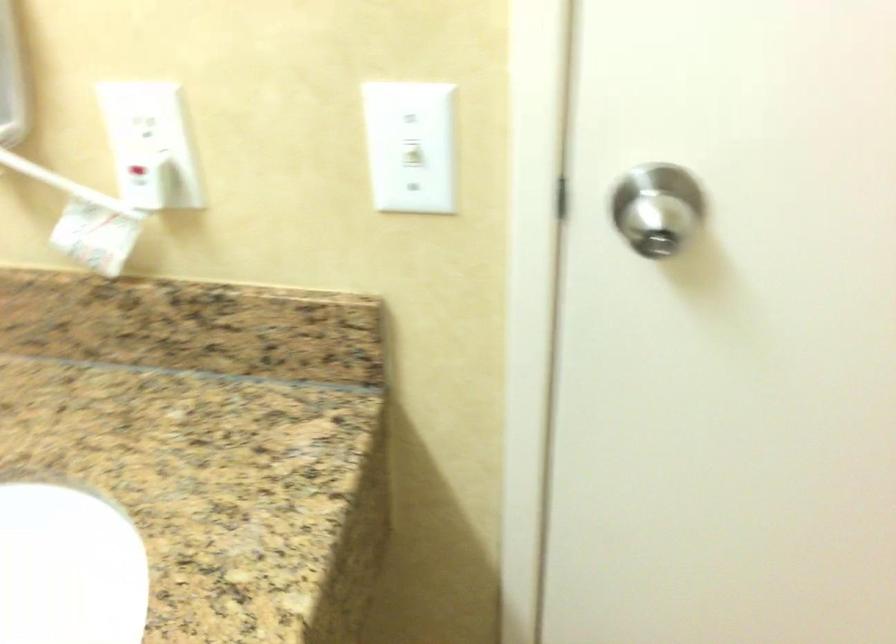
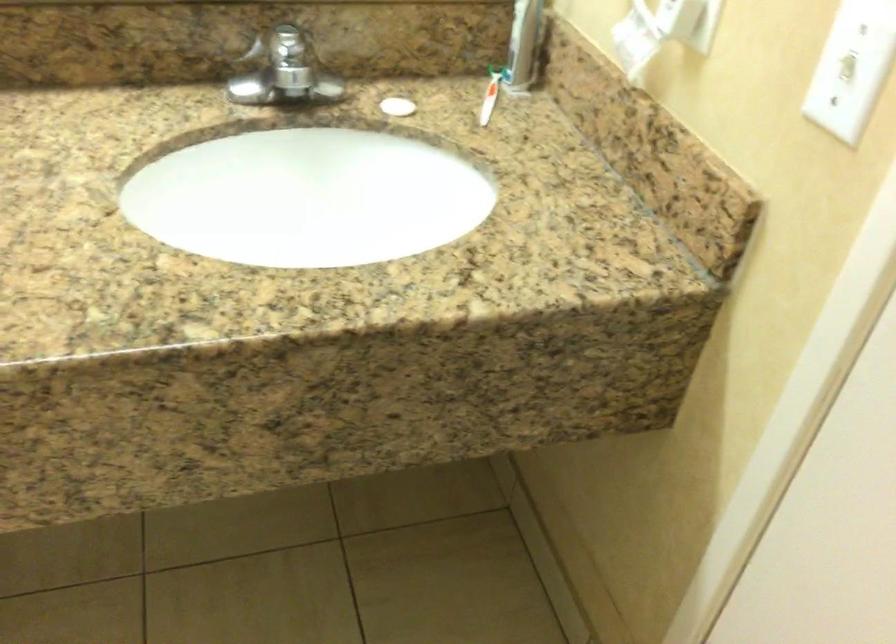
Find the pixel in the second image that matches (x=418, y=152) in the first image.

(851, 68)